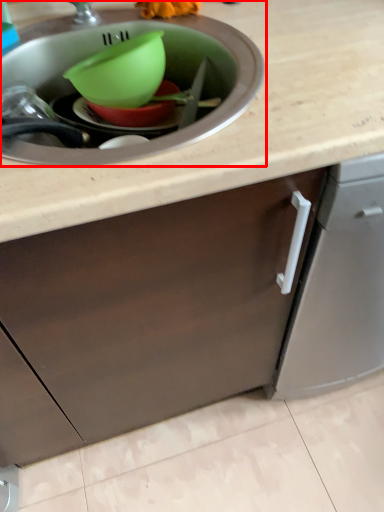
Question: From the image's perspective, what is the correct spatial positioning of sink (annotated by the red box) in reference to basin?

Choices:
 (A) below
 (B) above

Answer: (A)